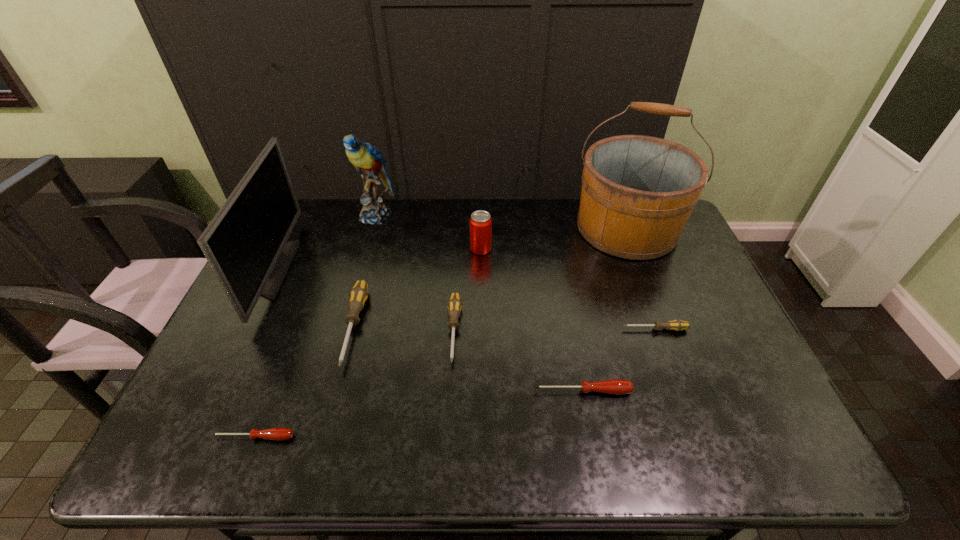
Locate an element on the screen. Image resolution: width=960 pixels, height=540 pixels. blank space that satisfies the following two spatial constraints: 1. on the face of the parrot; 2. on the left side of the bucket is located at coordinates (372, 228).

Find the location of `free space that satisfies the following two spatial constraints: 1. on the screen side of the monitor; 2. on the back side of the shortest object`. free space that satisfies the following two spatial constraints: 1. on the screen side of the monitor; 2. on the back side of the shortest object is located at coordinates (189, 437).